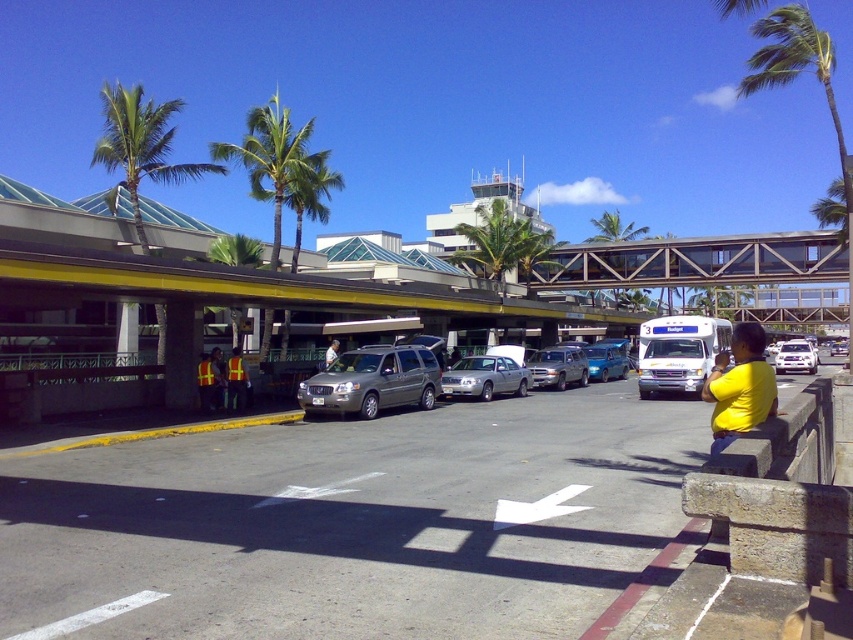
Question: Is metallic silver minivan at center smaller than yellow shirt at center?

Choices:
 (A) yes
 (B) no

Answer: (B)

Question: Which point is farther from the camera taking this photo?

Choices:
 (A) (334, 353)
 (B) (242, 385)
 (C) (706, 394)
 (D) (805, 355)

Answer: (D)

Question: Which point is closer to the camera?

Choices:
 (A) (730, 372)
 (B) (212, 376)

Answer: (A)

Question: Which point is farther to the camera?

Choices:
 (A) silver metallic sedan at center
 (B) reflective safety vest at center

Answer: (A)

Question: Can you confirm if green leafy palm tree at upper left is positioned to the right of yellow shirt at center?

Choices:
 (A) yes
 (B) no

Answer: (B)

Question: In this image, where is green leafy palm tree at upper left located relative to yellow matte shirt at lower right?

Choices:
 (A) below
 (B) above

Answer: (B)